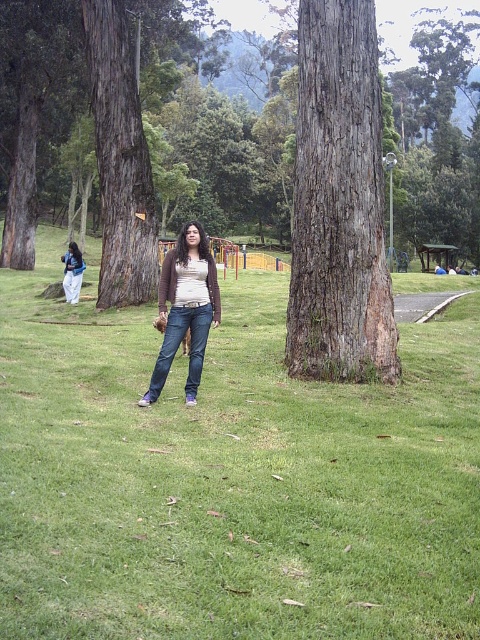
Question: Can you confirm if green grassy at center is positioned to the left of denim jeans at center?

Choices:
 (A) no
 (B) yes

Answer: (B)

Question: Does smooth brown bark at center have a greater width compared to brown rough bark tree at left?

Choices:
 (A) yes
 (B) no

Answer: (B)

Question: In this image, where is brown rough bark tree at left located relative to matte white pants at lower left?

Choices:
 (A) right
 (B) left

Answer: (A)

Question: Based on their relative distances, which object is farther from the matte white pants at lower left?

Choices:
 (A) brown rough bark tree at left
 (B) green grassy at center
 (C) denim jeans at center

Answer: (C)

Question: Which of the following is the farthest from the observer?

Choices:
 (A) matte white pants at lower left
 (B) brown rough bark tree at left
 (C) denim jeans at center
 (D) smooth brown bark at center

Answer: (A)

Question: Among these objects, which one is nearest to the camera?

Choices:
 (A) smooth brown bark at center
 (B) matte white pants at lower left
 (C) brown rough bark tree at left

Answer: (A)